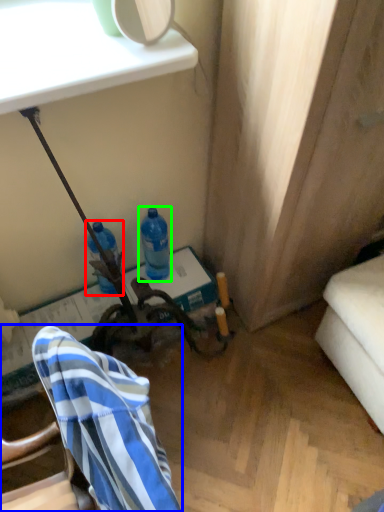
Question: Estimate the real-world distances between objects in this image. Which object is farther from bottle (highlighted by a red box), chair (highlighted by a blue box) or bottle (highlighted by a green box)?

Choices:
 (A) chair
 (B) bottle

Answer: (A)